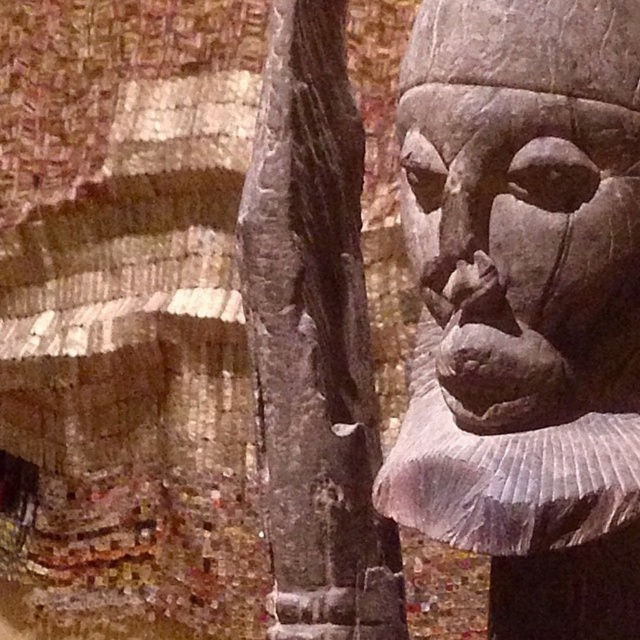
Based on the photo, is gray stone head at upper right positioned in front of dark gray stone pillar at center?

Yes, gray stone head at upper right is in front of dark gray stone pillar at center.

Which is more to the right, gray stone head at upper right or dark gray stone pillar at center?

Positioned to the right is gray stone head at upper right.

Is point (556, 125) more distant than point (268, 448)?

No, it is not.

Where is `gray stone head at upper right`? The width and height of the screenshot is (640, 640). gray stone head at upper right is located at coordinates (524, 196).